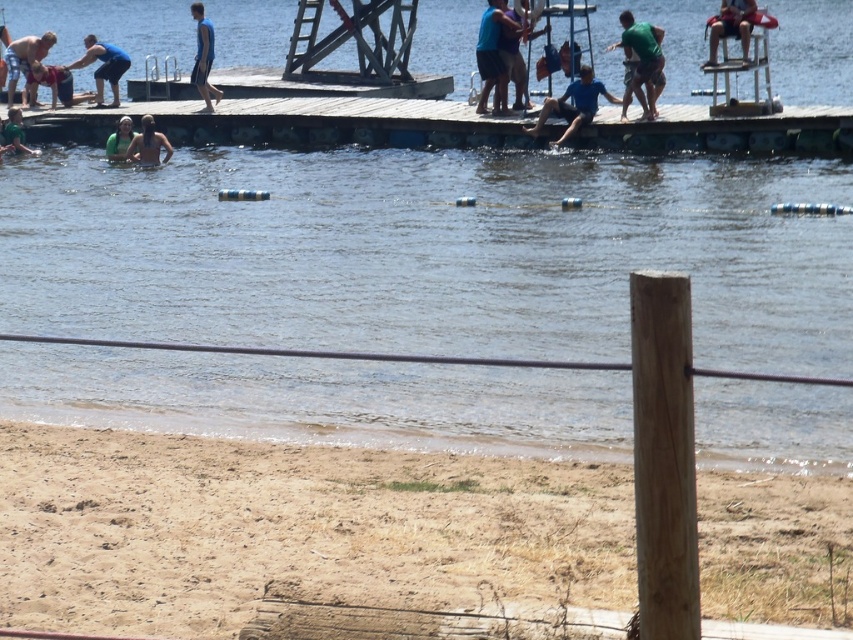
Question: Which point is farther from the camera taking this photo?

Choices:
 (A) (757, 605)
 (B) (202, 4)
 (C) (585, 112)

Answer: (B)

Question: Does blue t-shirt at center have a smaller size compared to blue fabric shirt at upper left?

Choices:
 (A) no
 (B) yes

Answer: (B)

Question: Which object is positioned farthest from the matte blue shorts at left?

Choices:
 (A) blue fabric shirt at upper left
 (B) blue t-shirt at center
 (C) matte blue swimsuit at lower left
 (D) green fabric swimsuit at lower left

Answer: (B)

Question: Which object is the farthest from the green matte shirt at upper center?

Choices:
 (A) matte blue shorts at left
 (B) blue fabric shorts at center

Answer: (A)

Question: Is wooden dock at center below green fabric swimmer at upper left?

Choices:
 (A) no
 (B) yes

Answer: (A)

Question: Is blue fabric shirt at upper left thinner than green fabric swimmer at upper left?

Choices:
 (A) no
 (B) yes

Answer: (A)